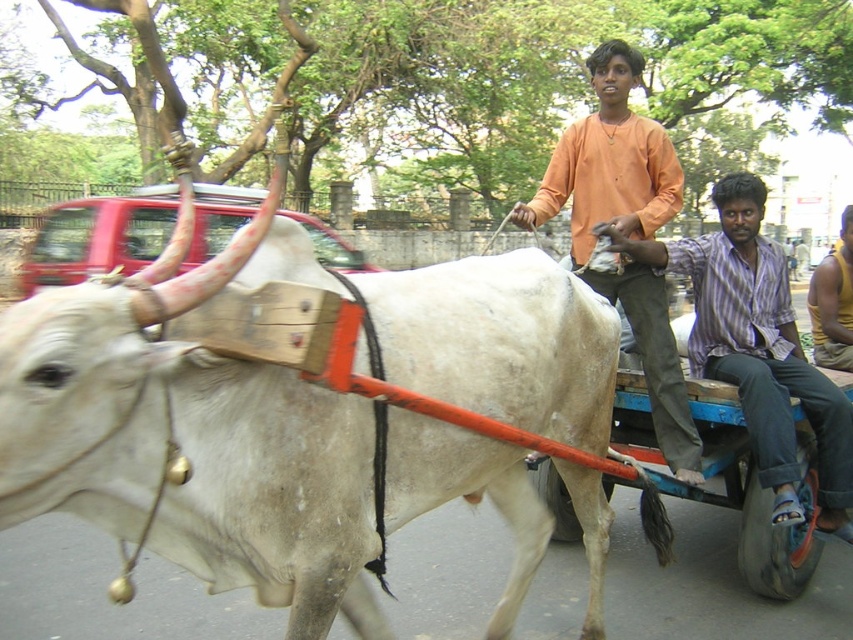
Question: Is striped cotton shirt at right below yellow cotton shirt at center?

Choices:
 (A) no
 (B) yes

Answer: (B)

Question: Among these objects, which one is farthest from the camera?

Choices:
 (A) white matte bull at center
 (B) striped cotton shirt at right
 (C) orange cotton shirt at center

Answer: (B)

Question: Is striped cotton shirt at right wider than yellow cotton shirt at center?

Choices:
 (A) yes
 (B) no

Answer: (B)

Question: Is the position of white matte bull at center more distant than that of yellow cotton shirt at center?

Choices:
 (A) yes
 (B) no

Answer: (B)

Question: Among these points, which one is nearest to the camera?

Choices:
 (A) 618,176
 (B) 122,285
 (C) 770,355
 (D) 843,316

Answer: (B)

Question: Estimate the real-world distances between objects in this image. Which object is farther from the yellow cotton shirt at center?

Choices:
 (A) white matte bull at center
 (B) orange cotton shirt at center

Answer: (A)